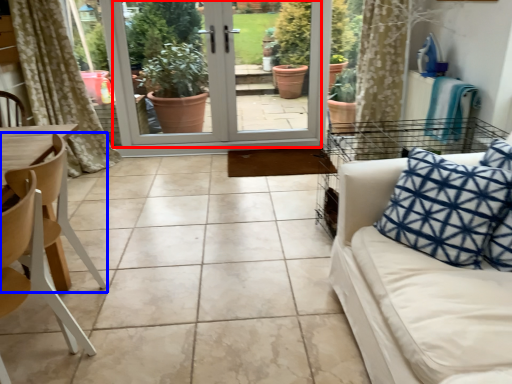
Question: Among these objects, which one is farthest to the camera, screen door (highlighted by a red box) or chair (highlighted by a blue box)?

Choices:
 (A) screen door
 (B) chair

Answer: (A)